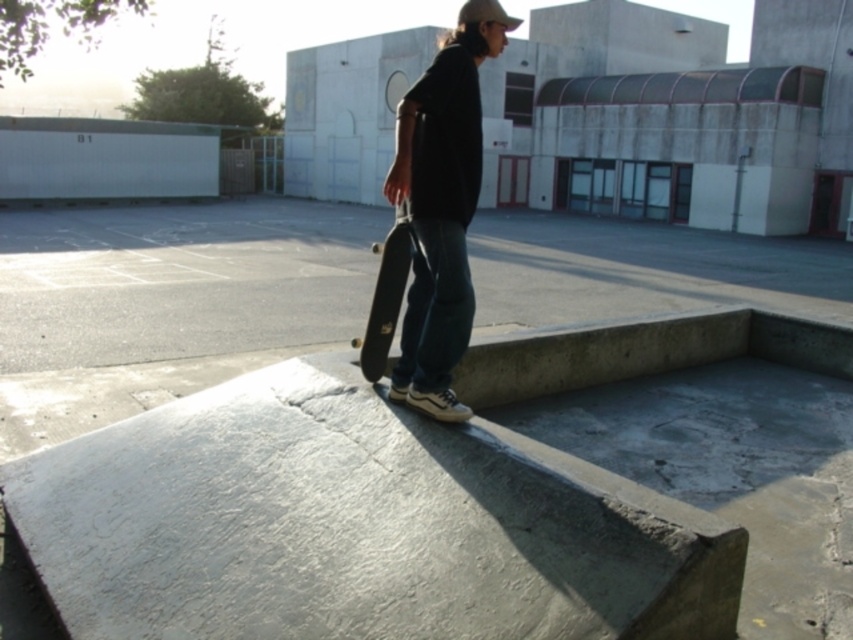
Can you confirm if matte black skateboard at center is positioned to the right of black smooth skateboard at center?

Indeed, matte black skateboard at center is positioned on the right side of black smooth skateboard at center.

Does matte black skateboard at center have a larger size compared to black smooth skateboard at center?

Correct, matte black skateboard at center is larger in size than black smooth skateboard at center.

Measure the distance between matte black skateboard at center and camera.

A distance of 3.09 meters exists between matte black skateboard at center and camera.

The height and width of the screenshot is (640, 853). Find the location of `matte black skateboard at center`. matte black skateboard at center is located at coordinates (440, 205).